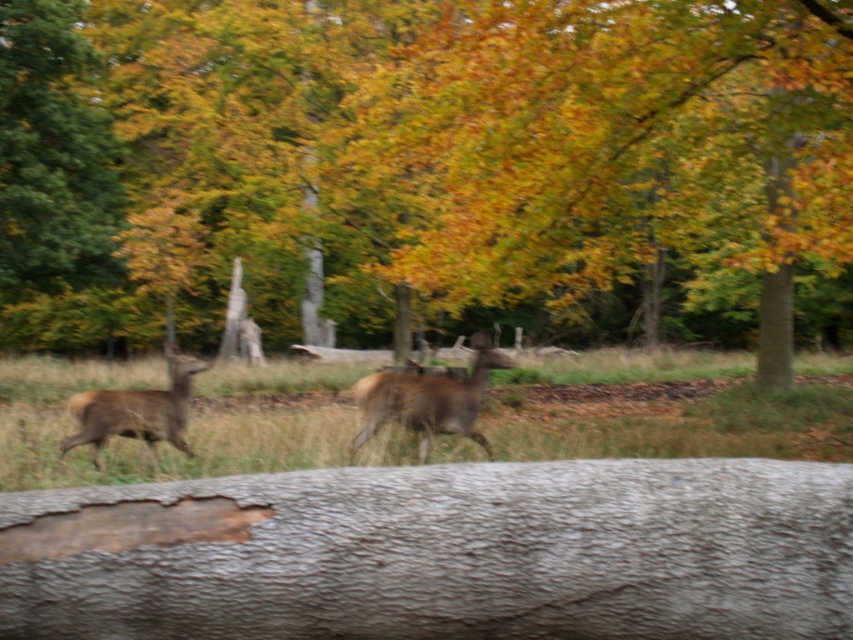
Question: Which point appears farthest from the camera in this image?

Choices:
 (A) (462, 396)
 (B) (149, 408)

Answer: (B)

Question: Is smooth gray log at center further to camera compared to brown matte/deer at center?

Choices:
 (A) no
 (B) yes

Answer: (A)

Question: Does brown textured log at center have a smaller size compared to brown fur deer at left?

Choices:
 (A) no
 (B) yes

Answer: (A)

Question: Which point is farther to the camera?

Choices:
 (A) brown matte/deer at center
 (B) brown fur deer at left
 (C) brown textured log at center

Answer: (C)

Question: Can you confirm if brown matte/deer at center is positioned to the left of brown fur deer at left?

Choices:
 (A) no
 (B) yes

Answer: (A)

Question: Which object is farther from the camera taking this photo?

Choices:
 (A) brown textured log at center
 (B) brown matte/deer at center
 (C) brown fur deer at left

Answer: (A)